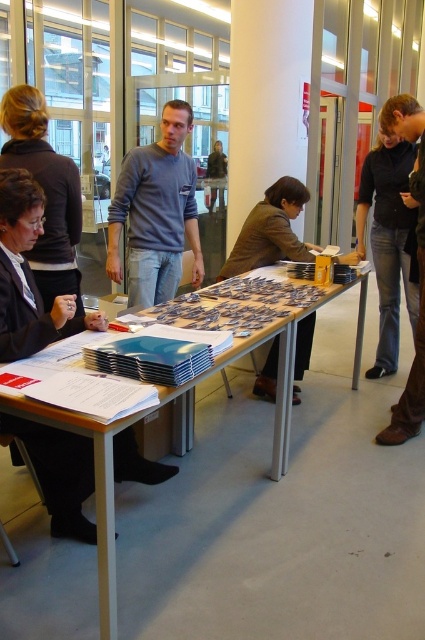
Between point (11, 416) and point (78, 176), which one is positioned in front?

Positioned in front is point (11, 416).

Describe the element at coordinates (28, 275) in the screenshot. This screenshot has height=640, width=425. I see `matte black jacket at lower left` at that location.

Locate an element on the screen. matte black jacket at lower left is located at coordinates (28, 275).

Does dark brown hair at upper left come in front of dark brown leather jacket at upper right?

Yes, it is.

Who is more forward, (48, 289) or (393, 120)?

Point (48, 289)

The width and height of the screenshot is (425, 640). I want to click on dark brown hair at upper left, so [x=45, y=193].

Does brown fabric jacket at center come behind matte gray sweater at center?

No.

Does brown fabric jacket at center appear under matte gray sweater at center?

Indeed, brown fabric jacket at center is positioned under matte gray sweater at center.

Locate an element on the screen. This screenshot has height=640, width=425. brown fabric jacket at center is located at coordinates (271, 230).